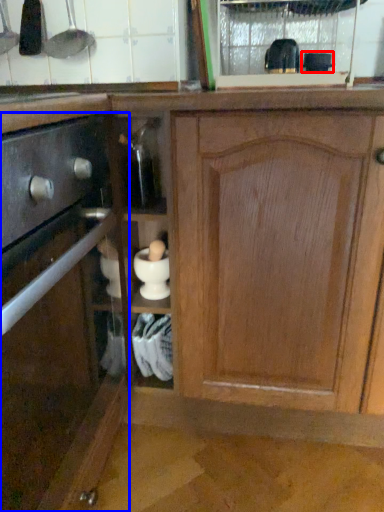
Question: Which object appears closest to the camera in this image, appliance (highlighted by a red box) or cabinetry (highlighted by a blue box)?

Choices:
 (A) appliance
 (B) cabinetry

Answer: (B)